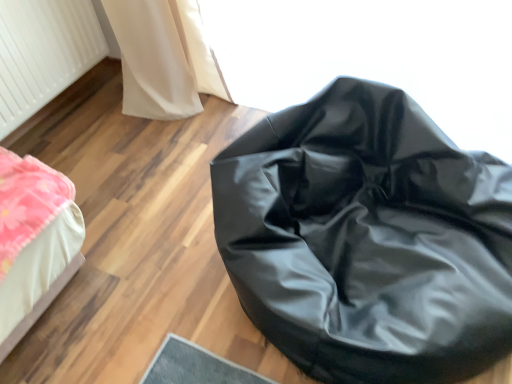
You are a GUI agent. You are given a task and a screenshot of the screen. Output one action in this format:
    pyautogui.click(x=<x>, y=<y>)
    Task: Click on the vacant space to the left of black leather bean bag at center
    
    Given the screenshot: What is the action you would take?
    pyautogui.click(x=142, y=263)